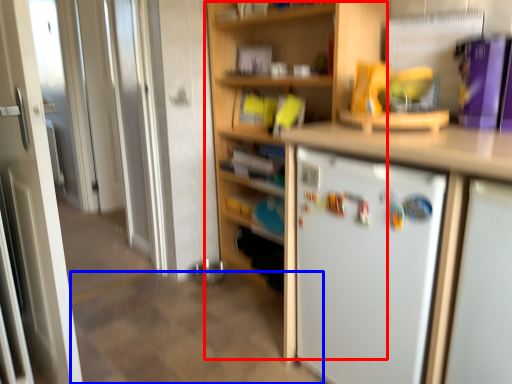
Question: Which point is further to the camera, bookshelf (highlighted by a red box) or tile (highlighted by a blue box)?

Choices:
 (A) bookshelf
 (B) tile

Answer: (A)